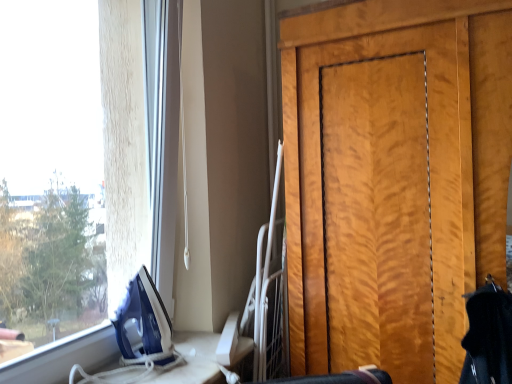
Question: Is white plastic table at lower left wider or thinner than wooden door at right?

Choices:
 (A) wide
 (B) thin

Answer: (B)

Question: From their relative heights in the image, would you say white plastic table at lower left is taller or shorter than wooden door at right?

Choices:
 (A) tall
 (B) short

Answer: (B)

Question: In the image, is white plastic table at lower left positioned in front of or behind wooden door at right?

Choices:
 (A) front
 (B) behind

Answer: (A)

Question: From the image's perspective, is wooden door at right located above or below white plastic table at lower left?

Choices:
 (A) above
 (B) below

Answer: (A)

Question: Relative to white plastic table at lower left, is wooden door at right in front or behind?

Choices:
 (A) behind
 (B) front

Answer: (A)

Question: Looking at the image, does wooden door at right seem bigger or smaller compared to white plastic table at lower left?

Choices:
 (A) small
 (B) big

Answer: (B)

Question: Considering the positions of point (437, 261) and point (190, 374), is point (437, 261) closer or farther from the camera than point (190, 374)?

Choices:
 (A) farther
 (B) closer

Answer: (A)